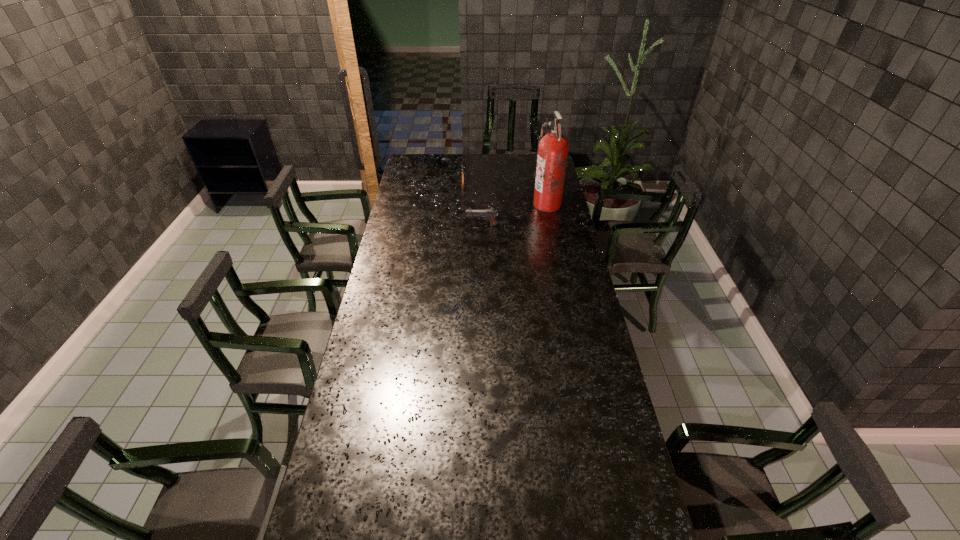
Locate an element on the screen. the second farthest object is located at coordinates (552, 152).

Find the location of a particular element. The height and width of the screenshot is (540, 960). the tallest object is located at coordinates (552, 152).

Image resolution: width=960 pixels, height=540 pixels. I want to click on the farthest object, so click(462, 165).

Locate an element on the screen. This screenshot has height=540, width=960. the leftmost object is located at coordinates (462, 165).

The image size is (960, 540). Identify the location of the second object from left to right. (490, 213).

Find the location of `the nearer gun`. the nearer gun is located at coordinates (490, 213).

I want to click on vacant space located 0.260m on the front of the tallest object near the operation label, so click(482, 205).

The height and width of the screenshot is (540, 960). What are the coordinates of `free region located on the front of the tallest object near the operation label` in the screenshot? It's located at (464, 205).

Locate an element on the screen. This screenshot has width=960, height=540. free spot located 0.300m on the front of the tallest object near the operation label is located at coordinates (474, 205).

At what (x,y) coordinates should I click in order to perform the action: click on blank space located along the barrel of the farthest object. Please return your answer as a coordinate pair (x, y). The image size is (960, 540). Looking at the image, I should click on (465, 163).